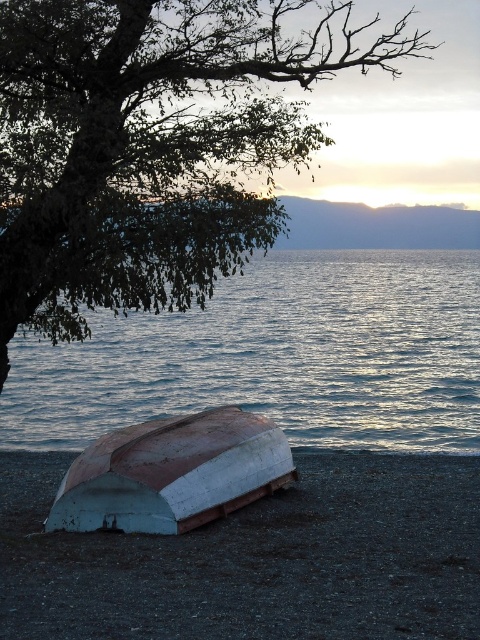
Based on the photo, you are standing on the lakeside and see the blue water at center and the white matte boat at lower left. Which object is located to the right of the other?

The blue water at center is positioned on the right side of the white matte boat at lower left.

You are a kayaker who has just arrived at the lakeside and see the green leafy tree at upper left and the white painted wood boat at lower center. You want to know if you can safely walk from your current position to the boat without getting wet. The water level is currently at 1 meter below the shore. Can you do it?

The distance between the green leafy tree at upper left and the white painted wood boat at lower center is 9.17 meters. Since the water level is 1 meter below the shore, the path between them is dry, so you can safely walk to the boat.